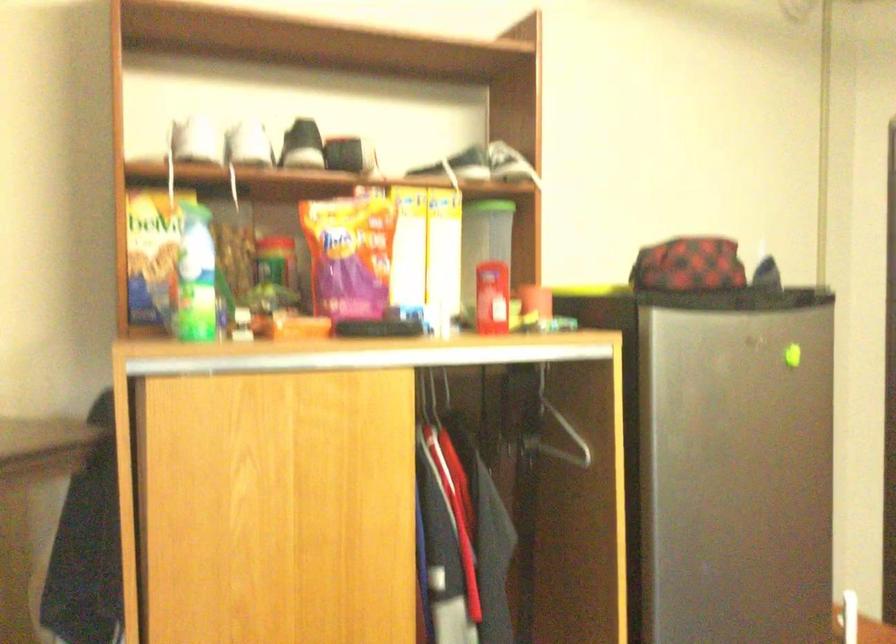
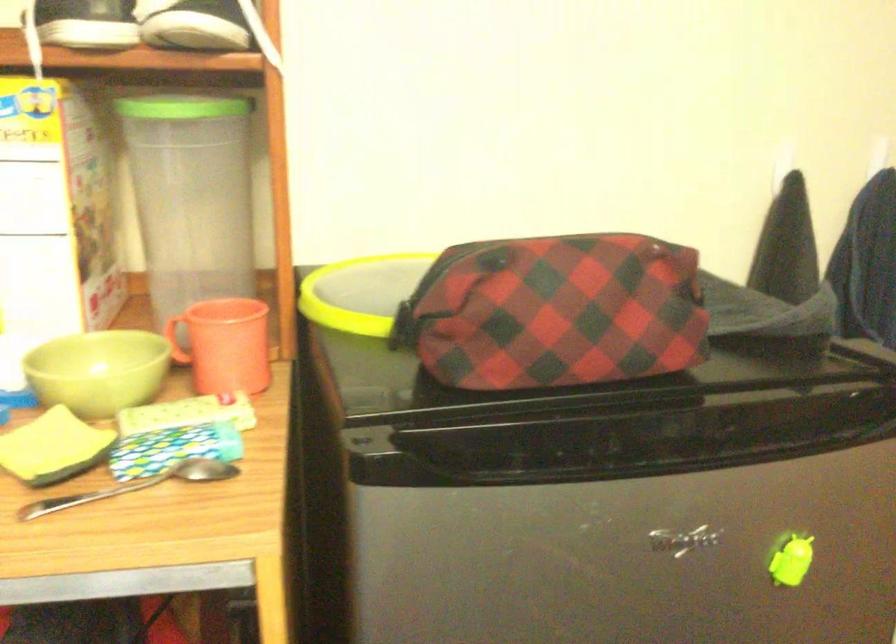
The point at (543, 298) is marked in the first image. Where is the corresponding point in the second image?

(224, 345)